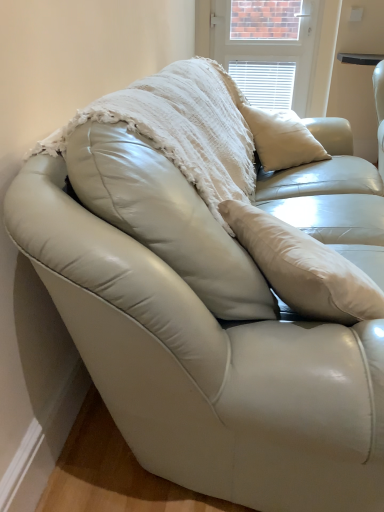
Question: Is white textured blanket at center outside of white leather table at upper right?

Choices:
 (A) yes
 (B) no

Answer: (A)

Question: From the image's perspective, is white textured blanket at center over white leather table at upper right?

Choices:
 (A) yes
 (B) no

Answer: (B)

Question: Is white textured blanket at center positioned behind white leather table at upper right?

Choices:
 (A) yes
 (B) no

Answer: (B)

Question: Does white textured blanket at center appear on the left side of white leather table at upper right?

Choices:
 (A) yes
 (B) no

Answer: (A)

Question: Could you tell me if white textured blanket at center is turned towards white leather table at upper right?

Choices:
 (A) yes
 (B) no

Answer: (B)

Question: Looking at the image, does white textured blinds at upper center seem bigger or smaller compared to white leather table at upper right?

Choices:
 (A) small
 (B) big

Answer: (A)

Question: Is white textured blinds at upper center in front of or behind white leather table at upper right in the image?

Choices:
 (A) front
 (B) behind

Answer: (B)

Question: Is white textured blinds at upper center wider or thinner than white leather table at upper right?

Choices:
 (A) wide
 (B) thin

Answer: (B)

Question: From their relative heights in the image, would you say white textured blinds at upper center is taller or shorter than white leather table at upper right?

Choices:
 (A) short
 (B) tall

Answer: (B)

Question: Is white textured blinds at upper center wider or thinner than white textured blanket at center?

Choices:
 (A) wide
 (B) thin

Answer: (B)

Question: In the image, is white textured blinds at upper center positioned in front of or behind white textured blanket at center?

Choices:
 (A) front
 (B) behind

Answer: (B)

Question: Is white textured blinds at upper center inside or outside of white textured blanket at center?

Choices:
 (A) inside
 (B) outside

Answer: (B)

Question: Does point (246, 44) appear closer or farther from the camera than point (213, 200)?

Choices:
 (A) farther
 (B) closer

Answer: (A)

Question: Is white textured blanket at center taller or shorter than white textured blinds at upper center?

Choices:
 (A) short
 (B) tall

Answer: (A)

Question: Visually, is white textured blanket at center positioned to the left or to the right of white textured blinds at upper center?

Choices:
 (A) right
 (B) left

Answer: (B)